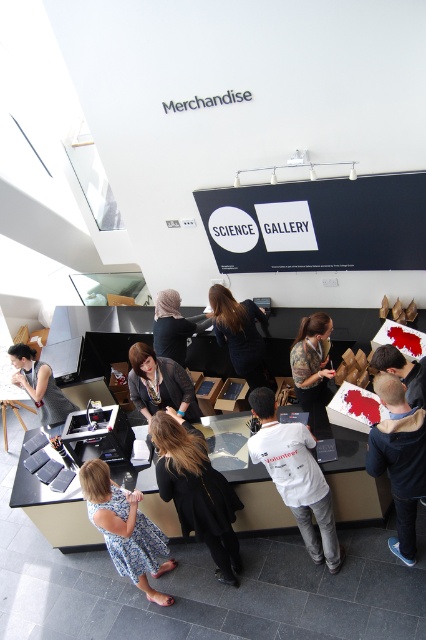
Question: Is blue fleece jacket at lower right above matte black jacket at center?

Choices:
 (A) no
 (B) yes

Answer: (A)

Question: Which object appears closest to the camera in this image?

Choices:
 (A) black matte signboard at upper center
 (B) matte black laptop at lower left
 (C) camouflage-patterned shirt at center
 (D) matte black shirt at center

Answer: (D)

Question: Is blue fleece jacket at lower right to the right of matte black shirt at center from the viewer's perspective?

Choices:
 (A) yes
 (B) no

Answer: (B)

Question: Which point appears farthest from the camera in this image?

Choices:
 (A) (249, 368)
 (B) (221, 556)

Answer: (A)

Question: Can you confirm if black matte signboard at upper center is positioned to the right of black matte jacket at center?

Choices:
 (A) no
 (B) yes

Answer: (B)

Question: Which is farther from the black matte signboard at upper center?

Choices:
 (A) white cotton t-shirt at center
 (B) blue fleece jacket at lower right
 (C) camouflage-patterned shirt at center
 (D) dark blue dress at center

Answer: (A)